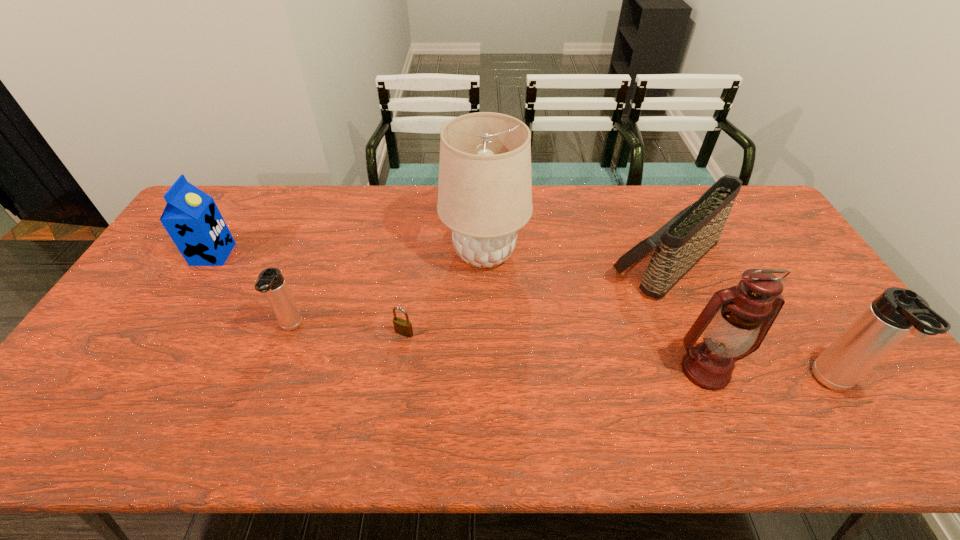
Find the location of `vacant space located 0.060m on the handle side of the second shortest object`. vacant space located 0.060m on the handle side of the second shortest object is located at coordinates (278, 360).

I want to click on vacant space located 0.170m on the right of the handbag, so click(x=780, y=261).

The width and height of the screenshot is (960, 540). I want to click on vacant space located with the cap open on the carton, so click(357, 254).

Identify the location of free space located 0.330m on the left of the third object from left to right. The image size is (960, 540). (271, 333).

Find the location of a particular element. Image resolution: width=960 pixels, height=540 pixels. vacant space positioned on the right of the lampshade is located at coordinates click(648, 254).

This screenshot has width=960, height=540. Find the location of `free spot located 0.110m on the back of the oil lamp`. free spot located 0.110m on the back of the oil lamp is located at coordinates (684, 318).

Where is `handbag situated at the far edge`? The height and width of the screenshot is (540, 960). handbag situated at the far edge is located at coordinates (690, 234).

Where is `lampshade positioned at the far edge`? Image resolution: width=960 pixels, height=540 pixels. lampshade positioned at the far edge is located at coordinates (485, 184).

The width and height of the screenshot is (960, 540). In order to click on thermos bottle situated at the near edge in this screenshot , I will do `click(897, 312)`.

The width and height of the screenshot is (960, 540). Identify the location of oil lamp that is positioned at the near edge. (735, 321).